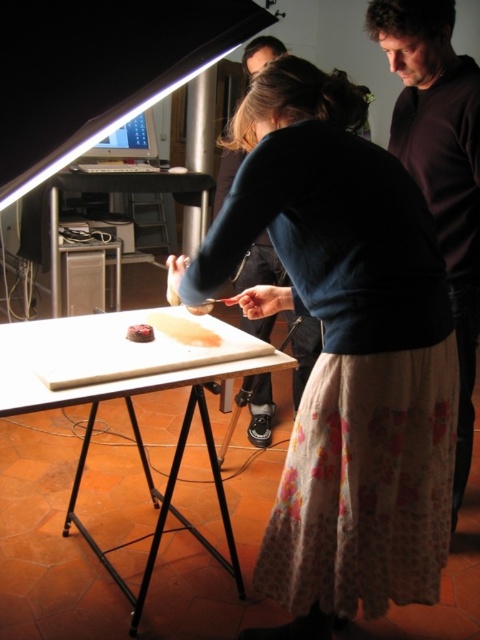
You are a photographer standing behind the tripod stand and want to take a photo of the chocolate cake at center. However, the dark brown leather jacket at upper center is blocking your view. Can you move the jacket to capture the cake clearly?

The dark brown leather jacket at upper center is further to the viewer than the chocolate cake at center, meaning it is closer to you. You can move the jacket to the side or remove it to get an unobstructed view of the cake.

You are organizing a photo shoot and need to ensure that the matte blue sweater at center and the chocolate cake at center are both visible in the frame. Based on their sizes, which object might require more space horizontally to fit properly?

The matte blue sweater at center might be wider than the chocolate cake at center, so it would require more horizontal space to fit properly in the photo shoot frame.

You are a chef preparing a dessert and need to place the matte blue sweater at center and the chocolate cake at center on a table. According to the scene, which item should be placed lower on the table?

The matte blue sweater at center should be placed lower on the table because it is positioned below the chocolate cake at center in the scene.